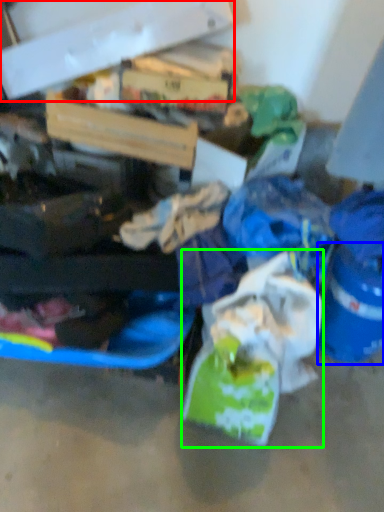
Question: Estimate the real-world distances between objects in this image. Which object is closer to box (highlighted by a red box), bucket (highlighted by a blue box) or plastic bag (highlighted by a green box)?

Choices:
 (A) bucket
 (B) plastic bag

Answer: (B)